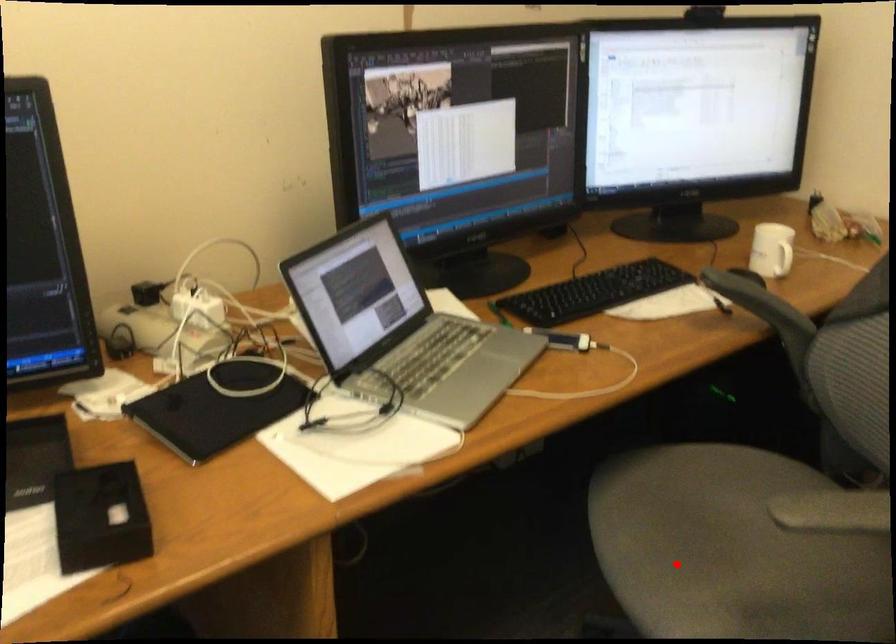
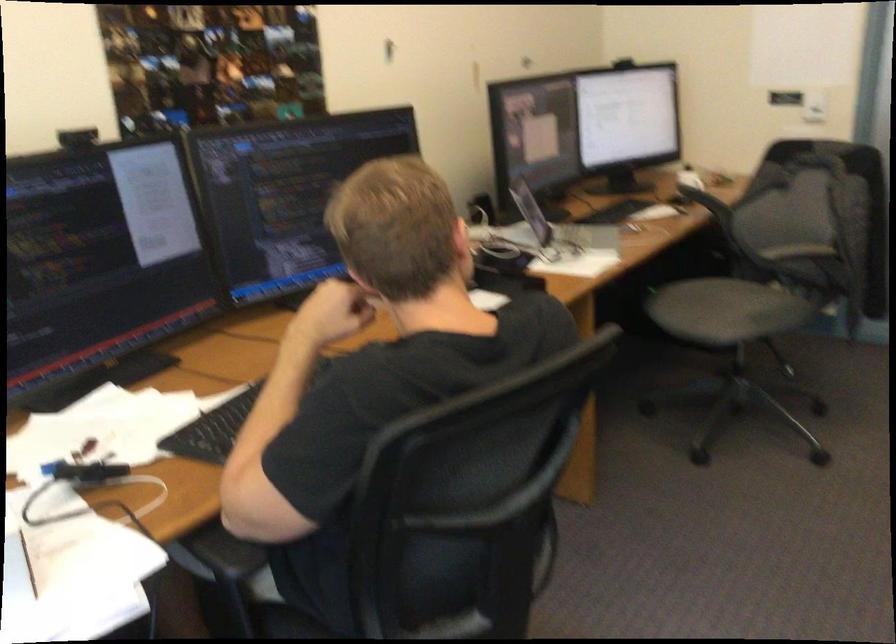
In the second image, find the point that corresponds to the highlighted location in the first image.

(709, 308)